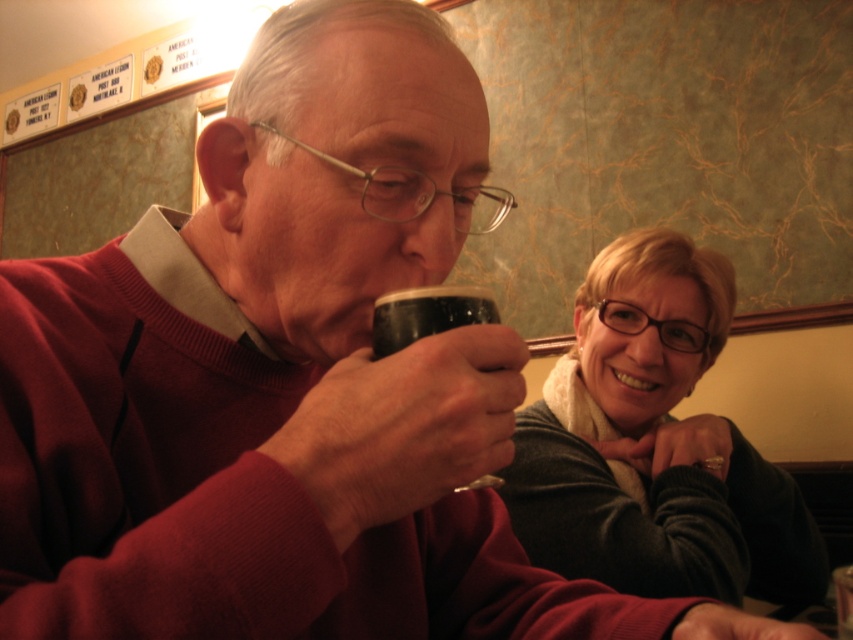
You are a photographer trying to capture a detailed shot of both the matte black sweater at upper right and the black matte cup at center. Which object should you focus on first if you want to ensure both are in sharp focus, considering their sizes?

The matte black sweater at upper right has a greater height compared to the black matte cup at center, so focusing on the taller object first would help ensure both are in sharp focus.

You are a barista trying to deliver a black matte cup at center to a customer. There is a matte black sweater at upper right on the table. Which object should you move first to access the cup?

You should move the matte black sweater at upper right first because it is located below the black matte cup at center, blocking access to it.